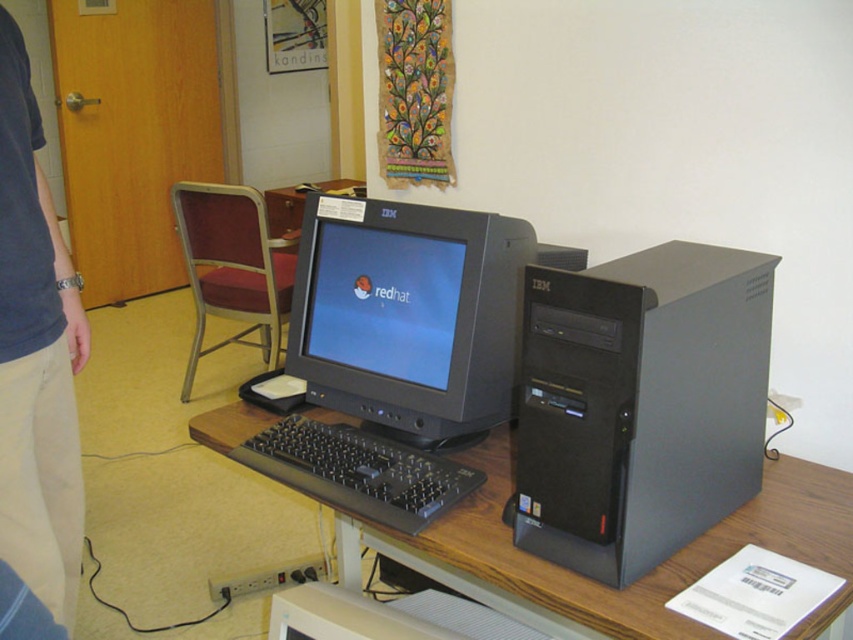
Question: Which object is closer to the camera taking this photo?

Choices:
 (A) brown wood computer desk at center
 (B) matte plastic monitor at center
 (C) matte black monitor at center
 (D) blue denim shirt at left

Answer: (A)

Question: Which point is farther to the camera?

Choices:
 (A) brown wood computer desk at center
 (B) black plastic computer tower at center-right

Answer: (B)

Question: Does matte black monitor at center have a larger size compared to blue denim shirt at left?

Choices:
 (A) no
 (B) yes

Answer: (A)

Question: Does black plastic computer tower at center-right appear over brown wood computer desk at center?

Choices:
 (A) yes
 (B) no

Answer: (A)

Question: Does blue denim shirt at left lie behind brown wood computer desk at center?

Choices:
 (A) yes
 (B) no

Answer: (A)

Question: Which point is farther to the camera?

Choices:
 (A) (822, 627)
 (B) (329, 483)

Answer: (B)